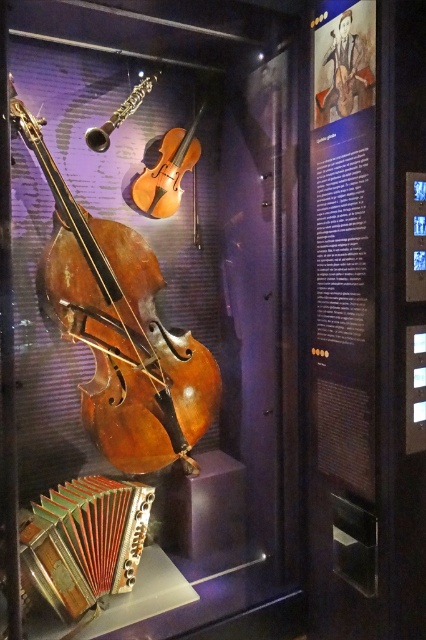
Question: Where is wooden polished cello at center located in relation to light brown wood violin at center in the image?

Choices:
 (A) above
 (B) below

Answer: (B)

Question: Which point is farther to the camera?

Choices:
 (A) (103, 269)
 (B) (176, 134)

Answer: (B)

Question: Can you confirm if gold metallic accordion at lower left is wider than light brown wood violin at center?

Choices:
 (A) no
 (B) yes

Answer: (B)

Question: Which point is closer to the camera?

Choices:
 (A) light brown wood violin at center
 (B) gold metallic accordion at lower left

Answer: (B)

Question: Which of the following is the closest to the observer?

Choices:
 (A) (97, 259)
 (B) (173, 182)

Answer: (A)

Question: Considering the relative positions of gold metallic accordion at lower left and light brown wood violin at center in the image provided, where is gold metallic accordion at lower left located with respect to light brown wood violin at center?

Choices:
 (A) left
 (B) right

Answer: (A)